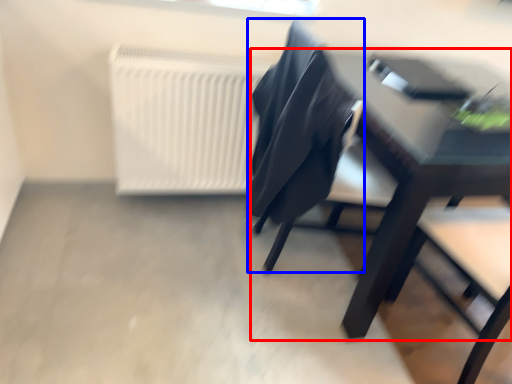
Question: Among these objects, which one is nearest to the camera, table (highlighted by a red box) or chair (highlighted by a blue box)?

Choices:
 (A) table
 (B) chair

Answer: (A)